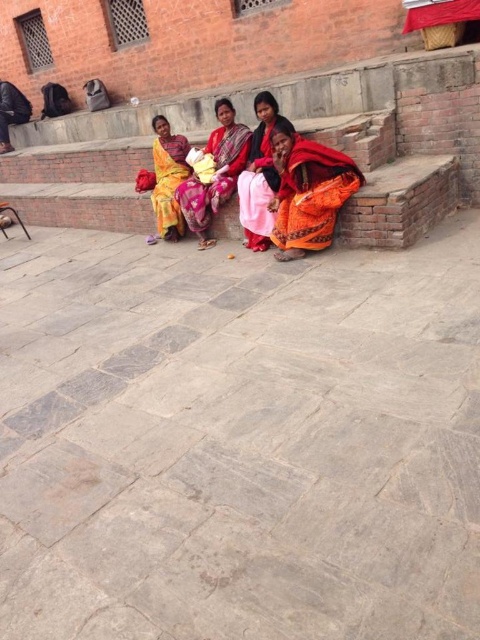
Can you confirm if orange fabric sari at lower right is positioned to the right of orange fabric at center?

Indeed, orange fabric sari at lower right is positioned on the right side of orange fabric at center.

Identify the location of orange fabric sari at lower right. The image size is (480, 640). (308, 192).

Which is behind, point (276, 234) or point (267, 122)?

The point (267, 122) is more distant.

This screenshot has width=480, height=640. What are the coordinates of `orange fabric sari at lower right` in the screenshot? It's located at (308, 192).

Who is lower down, orange fabric sari at lower right or orange fabric sari at center?

Positioned lower is orange fabric sari at lower right.

Which is behind, point (295, 218) or point (216, 184)?

The point (216, 184) is behind.

This screenshot has height=640, width=480. In order to click on orange fabric sari at lower right in this screenshot , I will do (308, 192).

Between matte yellow sari at left and matte black bag at left, which one is positioned higher?

matte black bag at left

Which is in front, point (168, 234) or point (7, 81)?

Point (168, 234)

At what (x,y) coordinates should I click in order to perform the action: click on matte yellow sari at left. Please return your answer as a coordinate pair (x, y). Looking at the image, I should click on (168, 179).